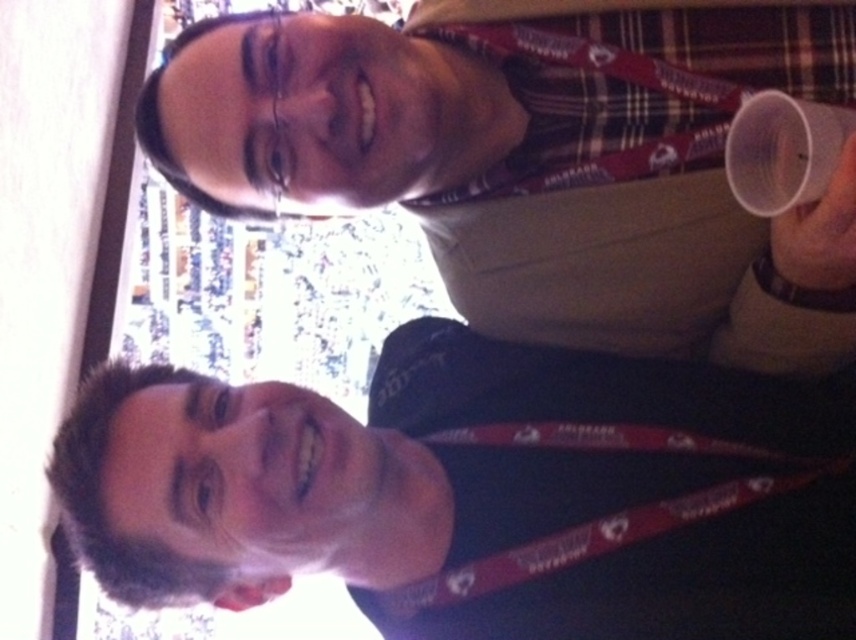
You are at a conference and need to take a photo of the transparent plastic cup at upper right. However, the white matte face at lower left is blocking your view. Based on their sizes, which object should you move closer to the camera to unblock the view?

The white matte face at lower left has a greater height compared to the transparent plastic cup at upper right, so you should move the white matte face at lower left closer to the camera to unblock the view of the transparent plastic cup at upper right.

You are at a conference and need to take a photo of the white matte face at lower left without including the matte plastic cup at upper right in the frame. Is this possible based on their positions?

The white matte face at lower left is located below the matte plastic cup at upper right, so it is possible to take a photo of the white matte face at lower left without including the matte plastic cup at upper right by adjusting the camera angle or cropping the image.